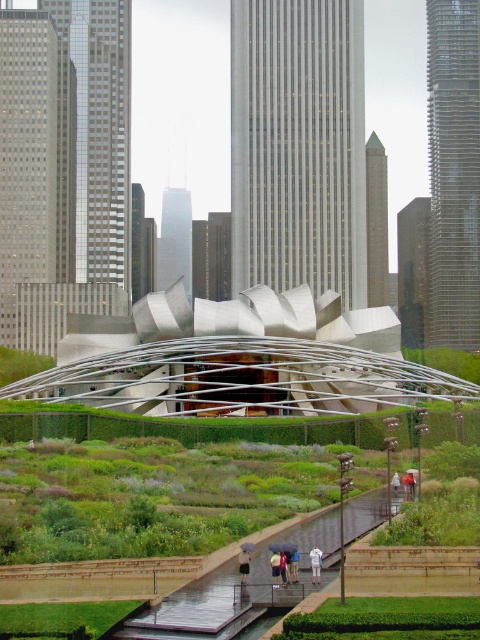
Can you confirm if white matte umbrella at center is positioned to the left of blue fabric umbrella at center?

Incorrect, white matte umbrella at center is not on the left side of blue fabric umbrella at center.

Is point (411, 490) more distant than point (295, 547)?

Yes, it is.

I want to click on white matte umbrella at center, so click(408, 484).

In the scene shown: Is glass skyscraper at right closer to camera compared to white cotton umbrella at center?

No, it is not.

Which is behind, point (451, 336) or point (247, 570)?

The point (451, 336) is behind.

Find the location of a particular element. The height and width of the screenshot is (640, 480). glass skyscraper at right is located at coordinates (454, 172).

Is polished stainless steel sculpture at center shorter than light blue fabric umbrella at center?

Incorrect, polished stainless steel sculpture at center's height does not fall short of light blue fabric umbrella at center's.

Can you confirm if polished stainless steel sculpture at center is positioned to the right of light blue fabric umbrella at center?

Incorrect, polished stainless steel sculpture at center is not on the right side of light blue fabric umbrella at center.

Is point (201, 97) in front of point (276, 563)?

No, (201, 97) is behind (276, 563).

Identify the location of polished stainless steel sculpture at center. (181, 100).